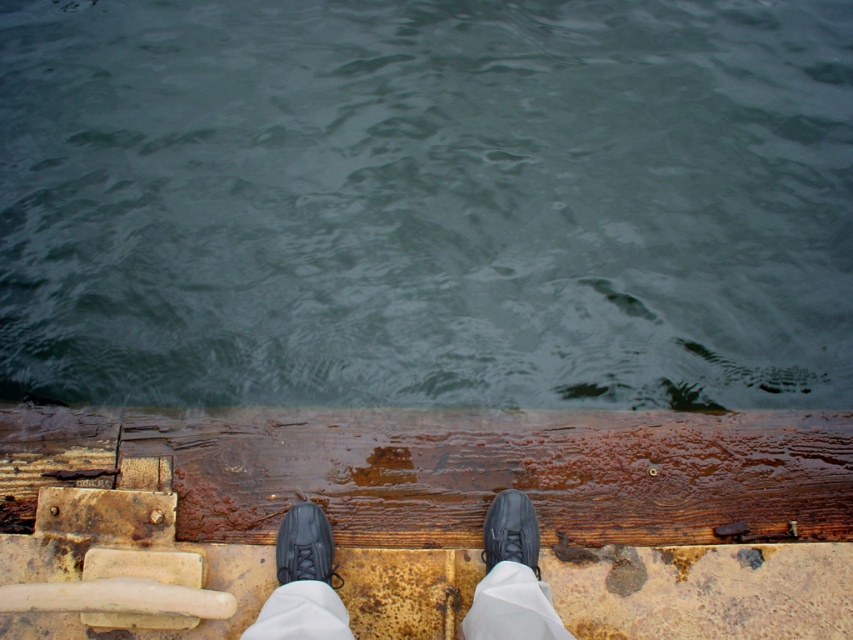
You are standing on the wooden dock and notice two black leather shoes. The black leather shoes at center and the black leather shoe at lower center. Which one is directly above the other?

The black leather shoes at center is positioned under the black leather shoe at lower center, so the black leather shoe at lower center is directly above the black leather shoes at center.

You are a photographer trying to capture the reflection of the black leather shoes at center and the black leather shoe at lower center in the water behind them. Which shoe will have a larger reflection in the water?

The black leather shoes at center will have a larger reflection in the water because it is larger in size than the black leather shoe at lower center.

You are standing on the wooden dock and want to step into the water. Which object, the green water at center or the black leather shoe at center, will you encounter first as you move forward?

The black leather shoe at center will be encountered first because it is positioned closer to your current location on the dock compared to the green water at center.